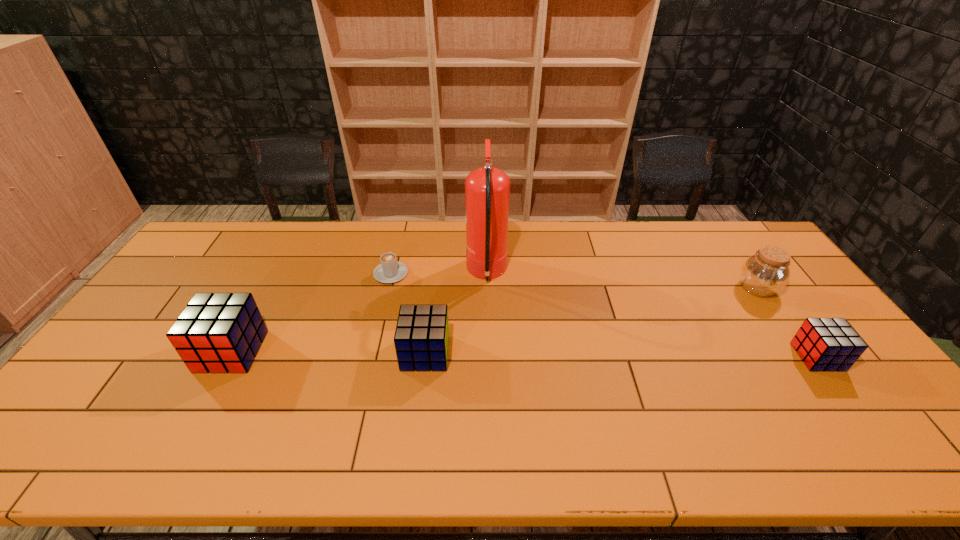
Please point a space for a new cube to maintain equal intervals. Please provide its 2D coordinates. Your answer should be formatted as a tuple, i.e. [(x, y)], where the tuple contains the x and y coordinates of a point satisfying the conditions above.

[(621, 355)]